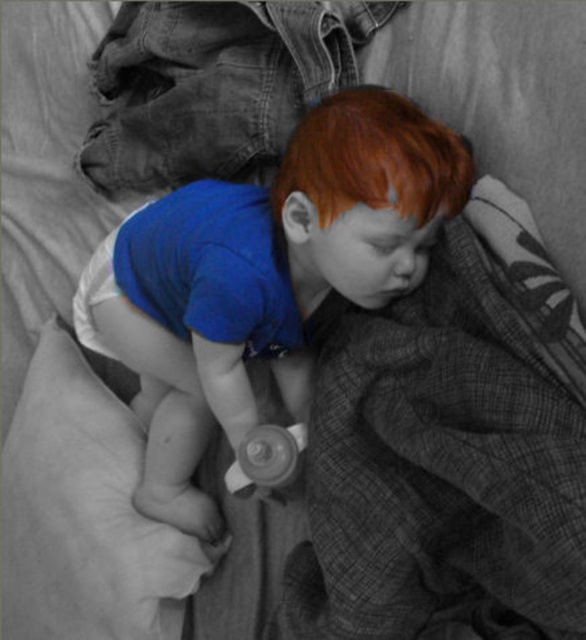
You are a photographer who wants to capture a closeup of the blue cotton shirt at center and the rubberized white pacifier at center in the image. Given that your camera can only focus on objects wider than 5 cm, can both items be captured clearly?

The blue cotton shirt at center has a larger width than the rubberized white pacifier at center. However, since the exact measurements are not provided, we cannot confirm if both are wider than 5 cm. Please check the actual sizes.